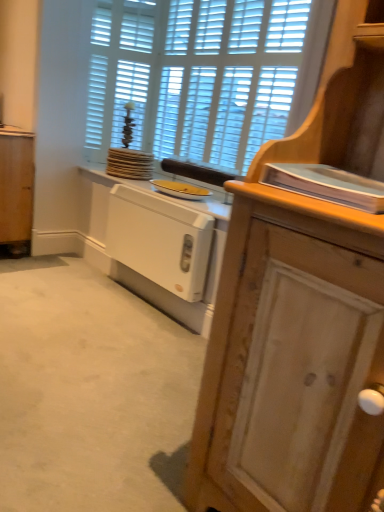
Question: Is white painted wood radiator at lower center, placed as the second cabinetry when sorted from back to front, surrounding white wooden shutters at upper center?

Choices:
 (A) yes
 (B) no

Answer: (B)

Question: From the image's perspective, is white painted wood radiator at lower center, the 2th cabinetry viewed from the right, on top of white wooden shutters at upper center?

Choices:
 (A) yes
 (B) no

Answer: (B)

Question: Is white painted wood radiator at lower center, placed as the second cabinetry when sorted from back to front, shorter than white wooden shutters at upper center?

Choices:
 (A) yes
 (B) no

Answer: (A)

Question: Is white painted wood radiator at lower center, which is the second cabinetry from front to back, outside white wooden shutters at upper center?

Choices:
 (A) no
 (B) yes

Answer: (B)

Question: Does white painted wood radiator at lower center, which is the second cabinetry from front to back, have a smaller size compared to white wooden shutters at upper center?

Choices:
 (A) no
 (B) yes

Answer: (B)

Question: Is white painted wood radiator at lower center, which appears as the second cabinetry when viewed from the left, aimed at white wooden shutters at upper center?

Choices:
 (A) no
 (B) yes

Answer: (A)

Question: Can you confirm if yellow matte plate at center is wider than white painted wood radiator at lower center, placed as the second cabinetry when sorted from back to front?

Choices:
 (A) no
 (B) yes

Answer: (B)

Question: Is yellow matte plate at center positioned beyond the bounds of white painted wood radiator at lower center, which is the second cabinetry from front to back?

Choices:
 (A) no
 (B) yes

Answer: (B)

Question: Is yellow matte plate at center not near white painted wood radiator at lower center, the 2th cabinetry viewed from the right?

Choices:
 (A) yes
 (B) no

Answer: (B)

Question: Is yellow matte plate at center behind white painted wood radiator at lower center, which is the second cabinetry from front to back?

Choices:
 (A) no
 (B) yes

Answer: (B)

Question: From the image's perspective, is yellow matte plate at center on top of white painted wood radiator at lower center, which appears as the second cabinetry when viewed from the left?

Choices:
 (A) no
 (B) yes

Answer: (B)

Question: Does yellow matte plate at center contain white painted wood radiator at lower center, which appears as the second cabinetry when viewed from the left?

Choices:
 (A) yes
 (B) no

Answer: (B)

Question: From a real-world perspective, is wooden cabinet at right positioned under white wooden shutters at upper center based on gravity?

Choices:
 (A) yes
 (B) no

Answer: (A)